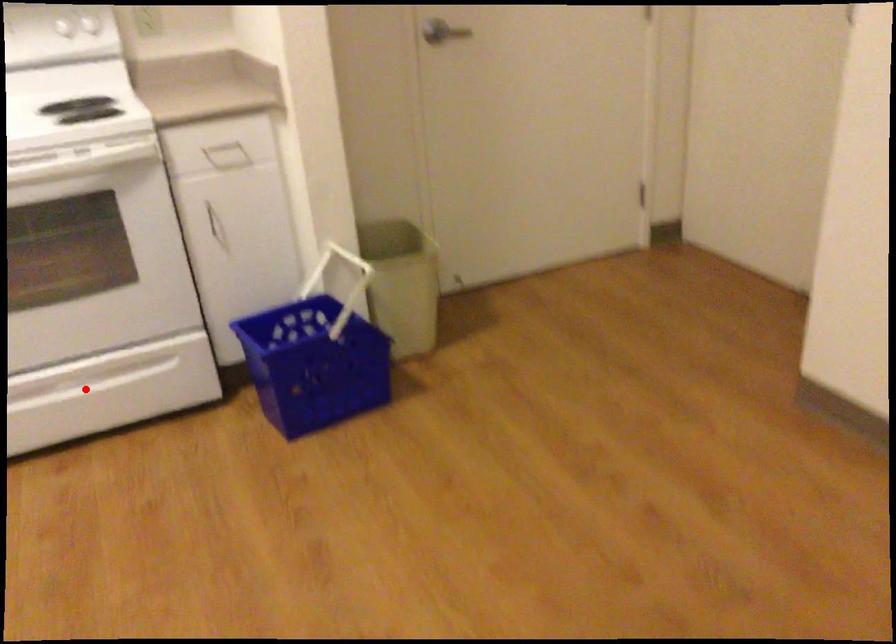
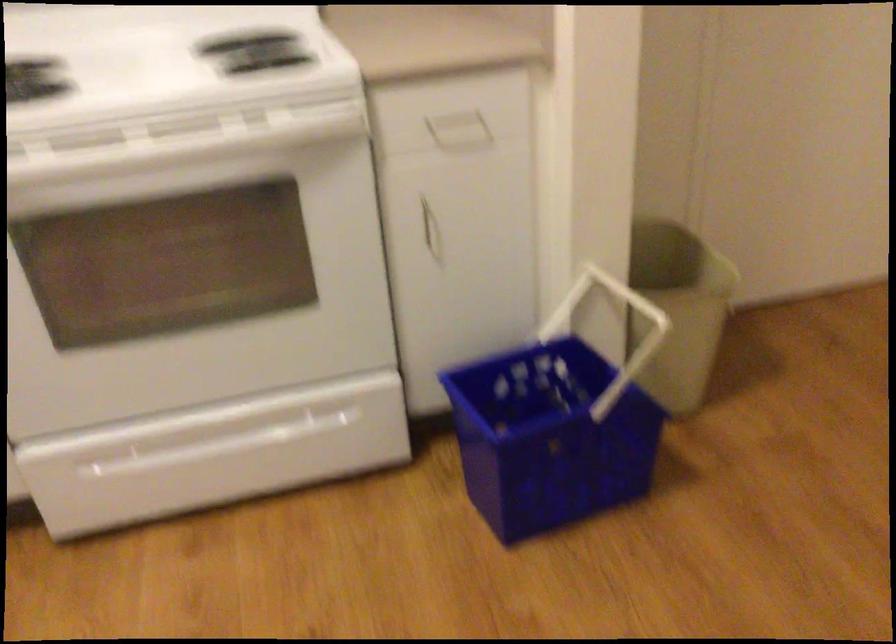
Question: A red point is marked in image1. In image2, is the corresponding 3D point closer to the camera or farther? Reply with the corresponding letter.

Choices:
 (A) The corresponding 3D point is closer.
 (B) The corresponding 3D point is farther.

Answer: (A)